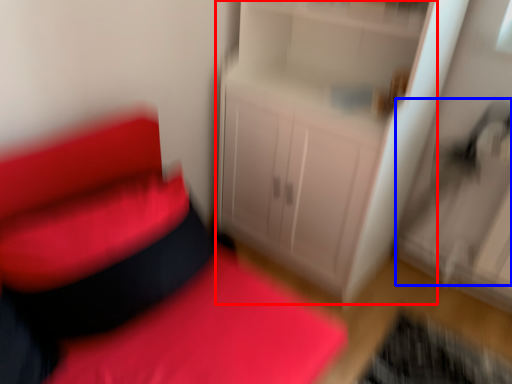
Question: Which point is closer to the camera, dresser (highlighted by a red box) or swivel chair (highlighted by a blue box)?

Choices:
 (A) dresser
 (B) swivel chair

Answer: (A)